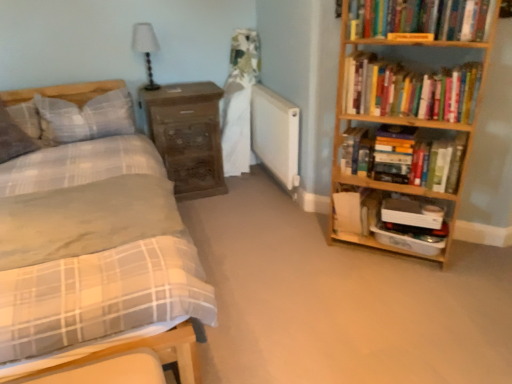
Identify the location of vacant space that is in between wooden carved chest of drawers at center and wooden cabinet at lower right. (258, 214).